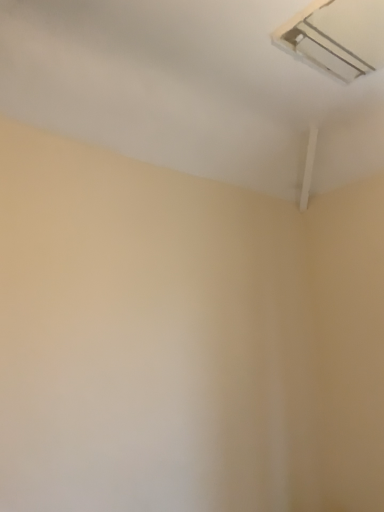
In order to face white glossy lampshade at upper right, should I rotate leftwards or rightwards?

Turn right by 22.549 degrees to look at white glossy lampshade at upper right.

The height and width of the screenshot is (512, 384). What do you see at coordinates (336, 37) in the screenshot?
I see `white glossy lampshade at upper right` at bounding box center [336, 37].

The image size is (384, 512). I want to click on white glossy lampshade at upper right, so click(x=336, y=37).

In order to click on white glossy lampshade at upper right in this screenshot , I will do `click(336, 37)`.